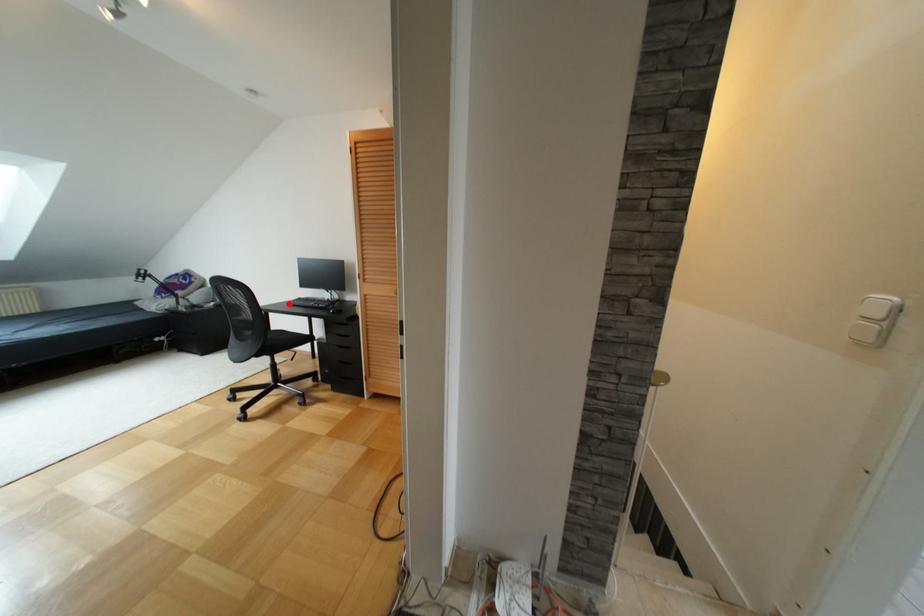
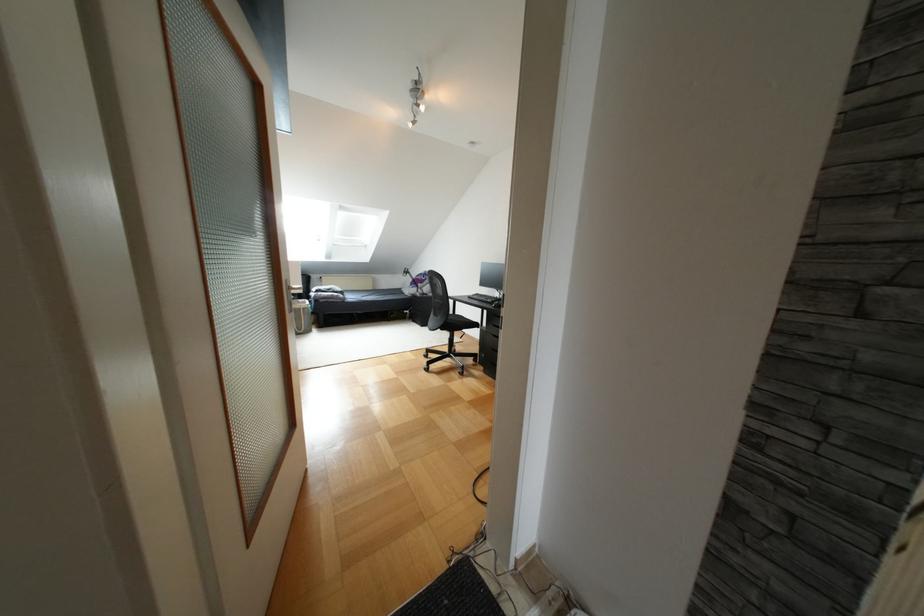
Find the pixel in the second image that matches the highlighted location in the first image.

(468, 297)